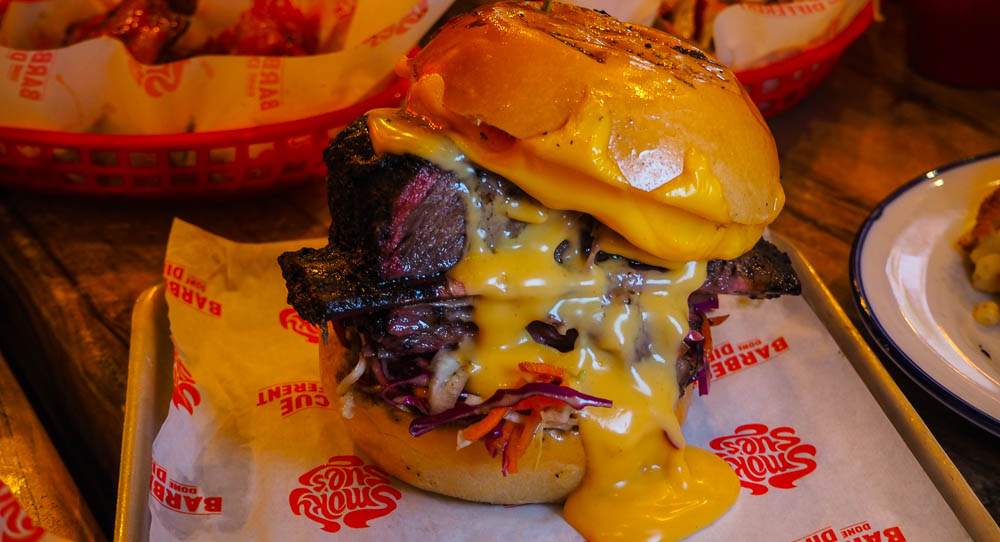
At what (x,y) coordinates should I click in order to perform the action: click on dish. Please return your answer as a coordinate pair (x, y). Image resolution: width=1000 pixels, height=542 pixels. Looking at the image, I should click on (910, 250).